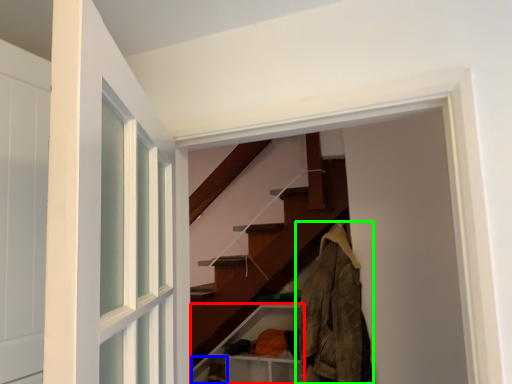
Question: Which object is the farthest from cabinet (highlighted by a red box)? Choose among these: shelf (highlighted by a blue box) or clothing (highlighted by a green box).

Choices:
 (A) shelf
 (B) clothing

Answer: (B)